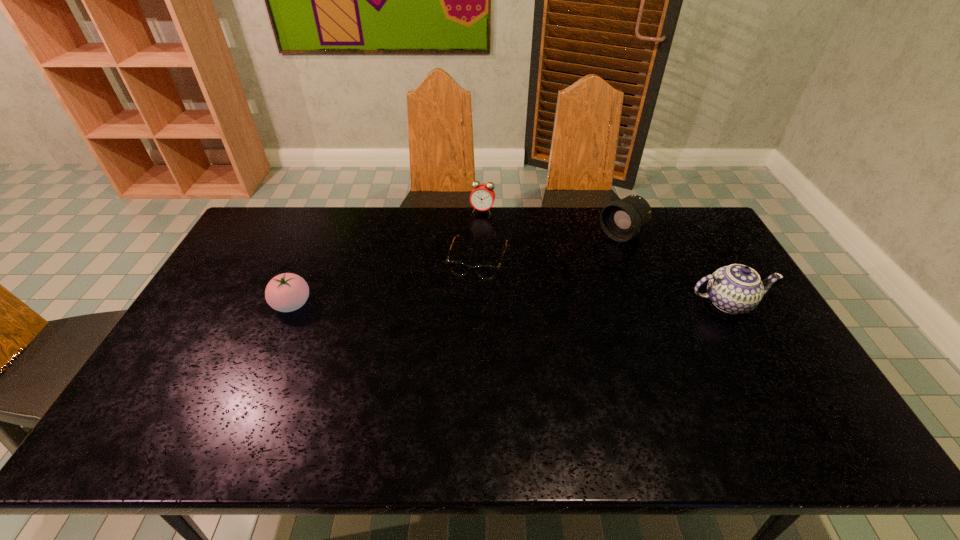
This screenshot has width=960, height=540. Find the location of `vacant spot on the desktop that is between the tomato and the chinaware and is positioned on the front-facing side of the spectacles`. vacant spot on the desktop that is between the tomato and the chinaware and is positioned on the front-facing side of the spectacles is located at coordinates (465, 304).

Find the location of a particular element. vacant space on the desktop that is between the leftmost object and the chinaware and is positioned at the front element of the second object from right to left is located at coordinates (520, 303).

At what (x,y) coordinates should I click in order to perform the action: click on vacant space on the desktop that is between the leftmost object and the rightmost object and is positioned on the front-facing side of the alarm clock. Please return your answer as a coordinate pair (x, y). Looking at the image, I should click on (456, 304).